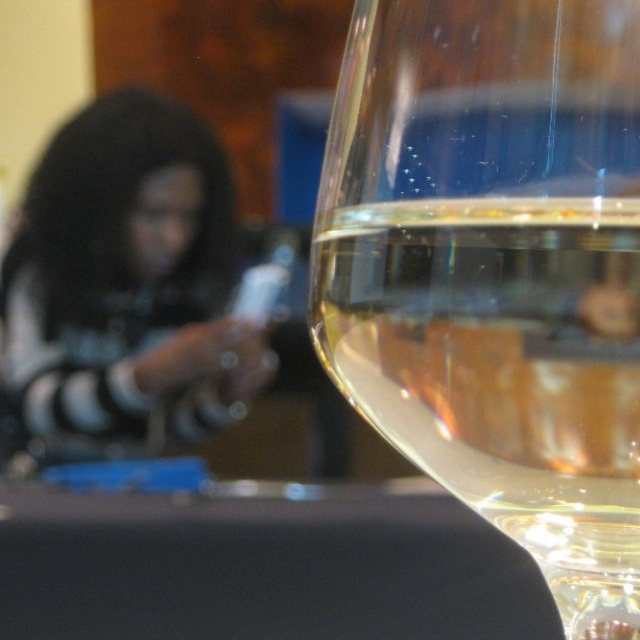
Question: Which point is closer to the camera?

Choices:
 (A) clear glass wine glass at right
 (B) black matte/soft fabric at left

Answer: (A)

Question: Can you confirm if clear glass wine glass at right is positioned below black matte/soft fabric at left?

Choices:
 (A) yes
 (B) no

Answer: (A)

Question: Which object is farther from the camera taking this photo?

Choices:
 (A) black matte/soft fabric at left
 (B) clear glass wine glass at right

Answer: (A)

Question: Is clear glass wine glass at right to the left of black matte/soft fabric at left from the viewer's perspective?

Choices:
 (A) no
 (B) yes

Answer: (A)

Question: Does clear glass wine glass at right have a greater width compared to black matte/soft fabric at left?

Choices:
 (A) no
 (B) yes

Answer: (A)